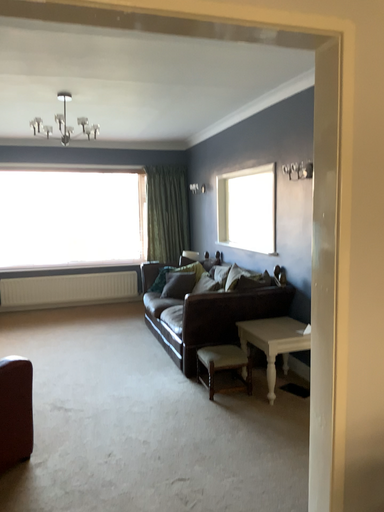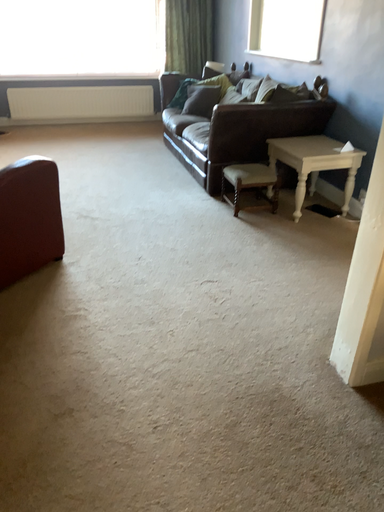
Question: Which way did the camera rotate in the video?

Choices:
 (A) rotated downward
 (B) rotated upward

Answer: (A)